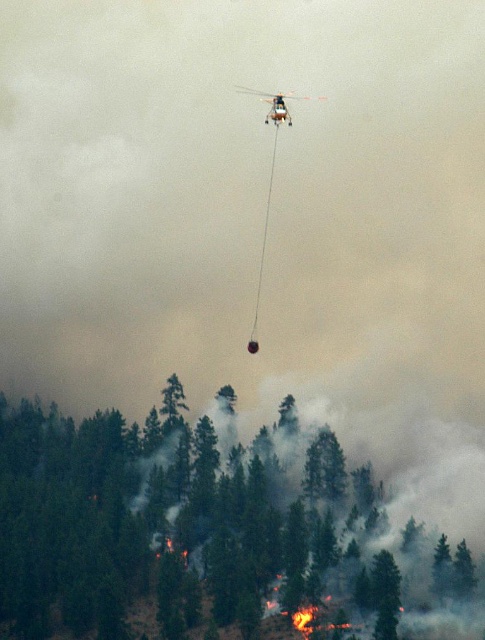
Does point (238, 474) lie in front of point (277, 99)?

No.

Between green matte tree at lower center and metallic silver helicopter at upper center, which one has less height?

metallic silver helicopter at upper center is shorter.

Where is `green matte tree at lower center`? This screenshot has width=485, height=640. green matte tree at lower center is located at coordinates (208, 532).